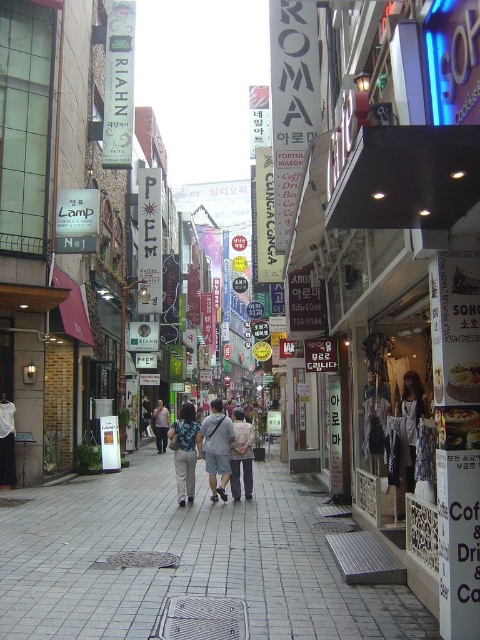
You are navigating through the urban street scene and need to move from the point at coordinates (216,445) to the point at coordinates (160,401). Given the layout of the buildings and the narrow passage between them, will moving directly towards the second point be possible without encountering any obstacles?

Point (216,445) is in front of point (160,401), meaning there is no obstruction between them. Therefore, moving directly towards the second point is possible without encountering obstacles.

You are a delivery person standing on the gray tile pavement at center and need to locate the blue textured shirt at center. In which direction should you move to find it?

The gray tile pavement at center is to the right of the blue textured shirt at center, so you should move to the left to find it.

You are a photographer trying to capture both the light blue denim shorts at center and the light blue denim pants at center in a single shot. Which item will appear larger in your photo?

The light blue denim shorts at center will appear larger because it is closer to the viewer than the light blue denim pants at center.